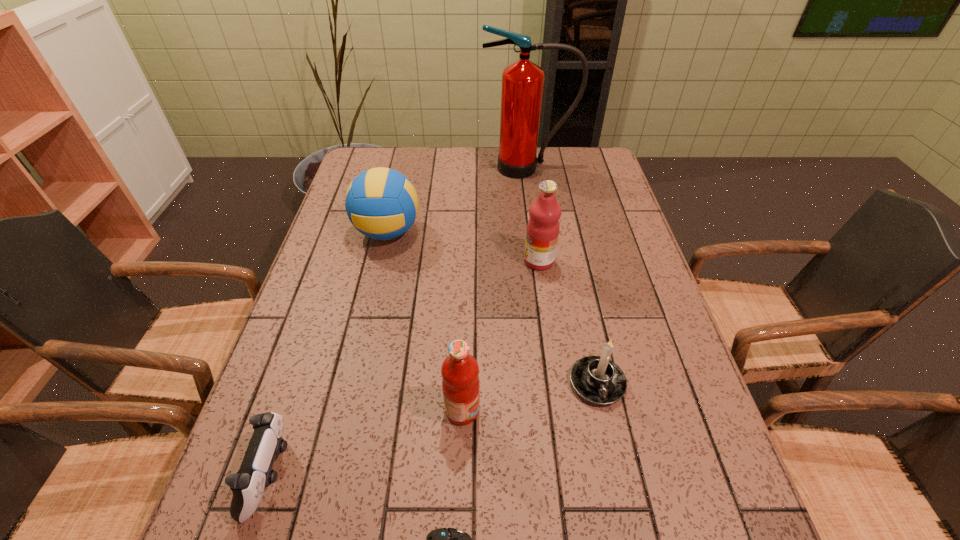
Locate an element on the screen. fire extinguisher located at the right edge is located at coordinates (522, 82).

Locate an element on the screen. The width and height of the screenshot is (960, 540). candle holder located at the right edge is located at coordinates (598, 380).

Where is `object that is positioned at the far right corner`? The image size is (960, 540). object that is positioned at the far right corner is located at coordinates (522, 82).

At what (x,y) coordinates should I click in order to perform the action: click on free space at the far edge of the desktop. Please return your answer as a coordinate pair (x, y). Image resolution: width=960 pixels, height=540 pixels. Looking at the image, I should click on (481, 167).

Find the location of a particular element. This screenshot has height=540, width=960. vacant region at the left edge is located at coordinates (344, 219).

Locate an element on the screen. The width and height of the screenshot is (960, 540). free region at the right edge is located at coordinates (x=694, y=468).

In the image, there is a desktop. At what (x,y) coordinates should I click in order to perform the action: click on vacant space at the far left corner. Please return your answer as a coordinate pair (x, y). Looking at the image, I should click on (362, 161).

This screenshot has width=960, height=540. In the image, there is a desktop. What are the coordinates of `vacant space at the near left corner` in the screenshot? It's located at (217, 532).

Find the location of a particular element. The height and width of the screenshot is (540, 960). unoccupied position between the right fruit juice and the control is located at coordinates (405, 367).

Where is `vacant area that lies between the right fruit juice and the shorter fruit juice`? This screenshot has height=540, width=960. vacant area that lies between the right fruit juice and the shorter fruit juice is located at coordinates (500, 336).